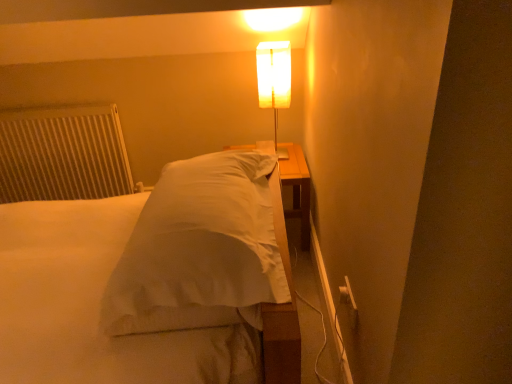
Question: Is point (66, 124) closer or farther from the camera than point (265, 86)?

Choices:
 (A) closer
 (B) farther

Answer: (B)

Question: Is white textured radiator at left situated inside translucent white lamp at upper center or outside?

Choices:
 (A) outside
 (B) inside

Answer: (A)

Question: Based on their relative distances, which object is nearer to the translucent white lamp at upper center?

Choices:
 (A) white satin bed at center
 (B) white textured radiator at left

Answer: (A)

Question: Which object is the farthest from the white satin bed at center?

Choices:
 (A) translucent white lamp at upper center
 (B) white textured radiator at left

Answer: (A)